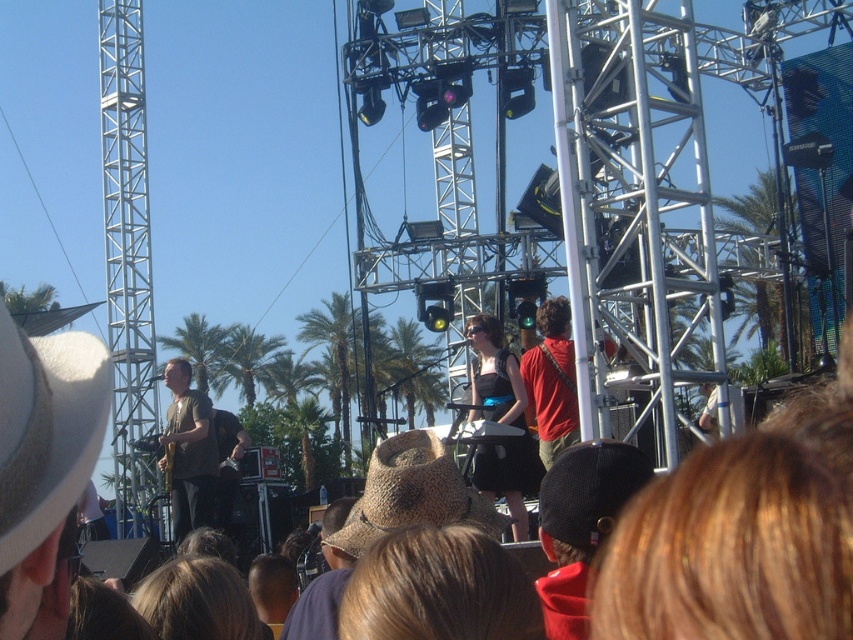
Who is positioned more to the right, brown straw cowboy hat at center or black satin dress at center?

black satin dress at center is more to the right.

Is brown straw cowboy hat at center shorter than black satin dress at center?

Yes, brown straw cowboy hat at center is shorter than black satin dress at center.

At what (x,y) coordinates should I click in order to perform the action: click on brown straw cowboy hat at center. Please return your answer as a coordinate pair (x, y). The image size is (853, 640). Looking at the image, I should click on (404, 492).

Where is `brown straw cowboy hat at center`? brown straw cowboy hat at center is located at coordinates (404, 492).

Is black satin dress at center to the left of black mesh cap at center from the viewer's perspective?

Correct, you'll find black satin dress at center to the left of black mesh cap at center.

Which of these two, black satin dress at center or black mesh cap at center, stands taller?

With more height is black satin dress at center.

Which is behind, point (506, 481) or point (550, 502)?

The point (506, 481) is more distant.

The width and height of the screenshot is (853, 640). What are the coordinates of `black satin dress at center` in the screenshot? It's located at (502, 422).

Describe the element at coordinates (404, 492) in the screenshot. I see `brown straw cowboy hat at center` at that location.

The height and width of the screenshot is (640, 853). In order to click on brown straw cowboy hat at center in this screenshot , I will do `click(404, 492)`.